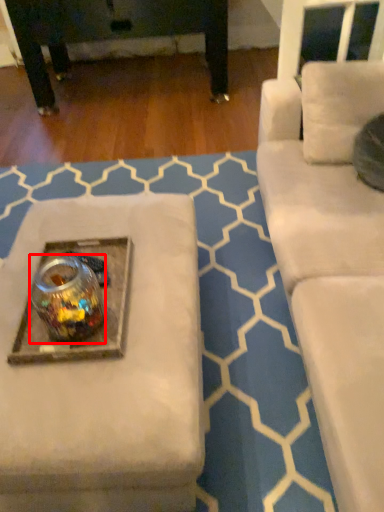
Question: From the image's perspective, considering the relative positions of beverage (annotated by the red box) and round table in the image provided, where is beverage (annotated by the red box) located with respect to the staircase?

Choices:
 (A) above
 (B) below

Answer: (B)